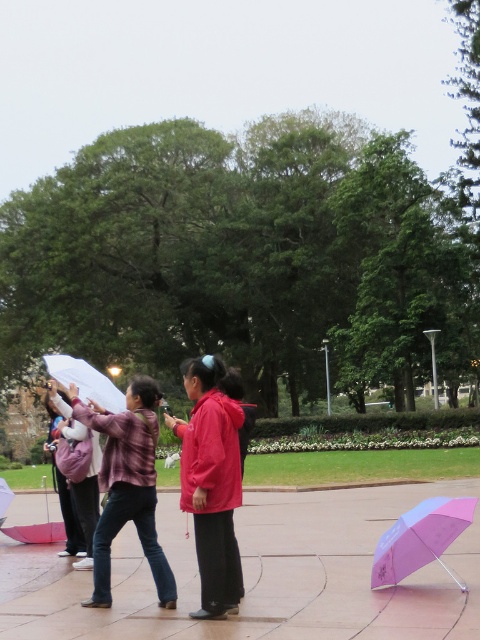
Can you confirm if pink matte umbrella at lower right is positioned above matte purple umbrella at left?

Indeed, pink matte umbrella at lower right is positioned over matte purple umbrella at left.

Is pink matte umbrella at lower right bigger than matte purple umbrella at left?

Incorrect, pink matte umbrella at lower right is not larger than matte purple umbrella at left.

This screenshot has height=640, width=480. I want to click on pink matte umbrella at lower right, so click(420, 538).

Which is more to the right, matte purple umbrella at left or matte red coat at center?

matte red coat at center

Which of these two, matte purple umbrella at left or matte red coat at center, stands shorter?

Standing shorter between the two is matte red coat at center.

Does point (72, 536) come in front of point (247, 444)?

No, it is not.

At what (x,y) coordinates should I click in order to perform the action: click on matte purple umbrella at left. Please return your answer as a coordinate pair (x, y). The image size is (480, 640). Looking at the image, I should click on (71, 522).

Based on the photo, which is above, matte purple umbrella at left or transparent plastic umbrella at lower left?

transparent plastic umbrella at lower left

Which is below, matte purple umbrella at left or transparent plastic umbrella at lower left?

matte purple umbrella at left

Which is behind, point (72, 529) or point (57, 536)?

The point (57, 536) is behind.

Where is `matte purple umbrella at left`? matte purple umbrella at left is located at coordinates (71, 522).